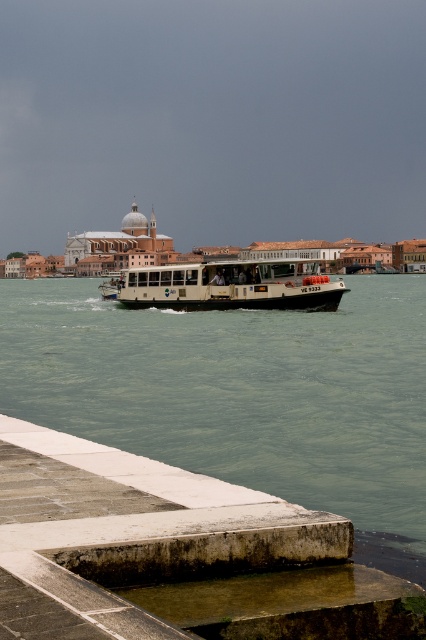
Question: Which is farther from the clear water at center?

Choices:
 (A) white matte boat at center
 (B) concrete dock at lower left

Answer: (B)

Question: Can you confirm if clear water at center is bigger than white matte boat at center?

Choices:
 (A) yes
 (B) no

Answer: (A)

Question: Which of the following is the closest to the observer?

Choices:
 (A) 88,592
 (B) 405,390

Answer: (A)

Question: Which object is farther from the camera taking this photo?

Choices:
 (A) concrete dock at lower left
 (B) clear water at center
 (C) white matte boat at center

Answer: (C)

Question: Is clear water at center below white matte boat at center?

Choices:
 (A) yes
 (B) no

Answer: (A)

Question: Can you confirm if clear water at center is smaller than concrete dock at lower left?

Choices:
 (A) yes
 (B) no

Answer: (B)